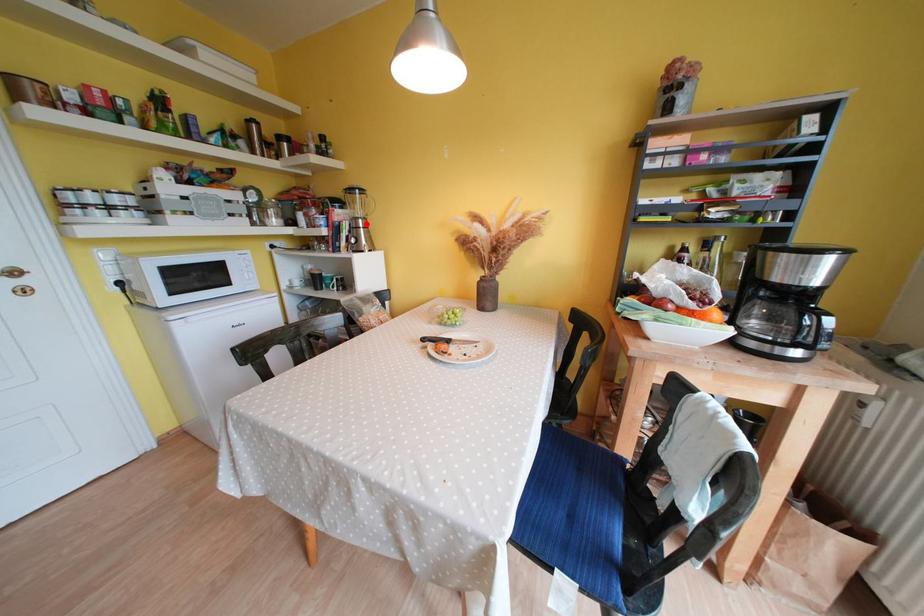
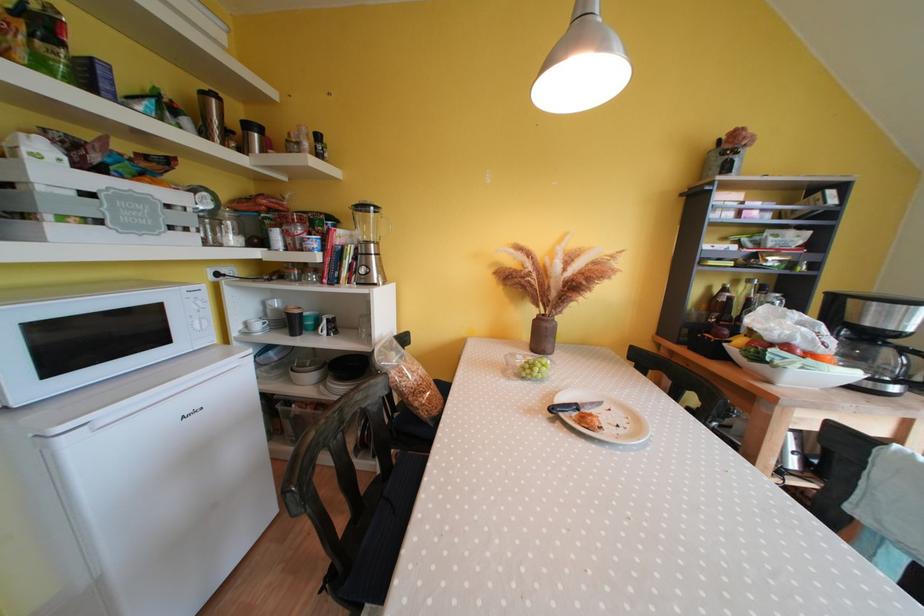
The point at the highlighted location is marked in the first image. Where is the corresponding point in the second image?

(379, 249)